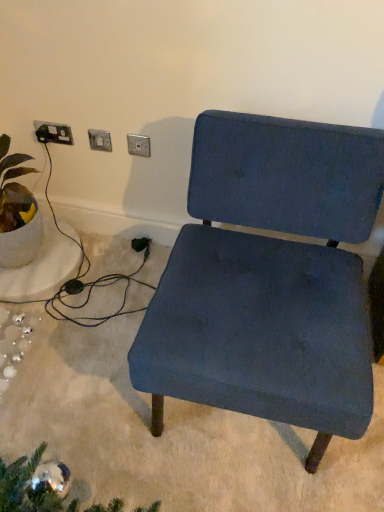
Question: Which direction should I rotate to look at matte silver switch at upper center, arranged as the second electric outlet when viewed from the right?

Choices:
 (A) right
 (B) left

Answer: (B)

Question: From the image's perspective, does black plastic socket at upper left, the first electric outlet positioned from the left, appear lower than metallic silver outlet at upper center, the 1th electric outlet from the right?

Choices:
 (A) yes
 (B) no

Answer: (B)

Question: Is black plastic socket at upper left, placed as the 3th electric outlet when sorted from right to left, wider than metallic silver outlet at upper center, the 1th electric outlet from the right?

Choices:
 (A) yes
 (B) no

Answer: (B)

Question: Does black plastic socket at upper left, the first electric outlet positioned from the left, have a lesser width compared to metallic silver outlet at upper center, the 1th electric outlet from the right?

Choices:
 (A) yes
 (B) no

Answer: (A)

Question: From a real-world perspective, is black plastic socket at upper left, placed as the 3th electric outlet when sorted from right to left, below metallic silver outlet at upper center, which is the third electric outlet in left-to-right order?

Choices:
 (A) yes
 (B) no

Answer: (B)

Question: Does black plastic socket at upper left, the first electric outlet positioned from the left, come in front of metallic silver outlet at upper center, the 1th electric outlet from the right?

Choices:
 (A) yes
 (B) no

Answer: (B)

Question: Would you say metallic silver outlet at upper center, the 1th electric outlet from the right, is part of black plastic socket at upper left, placed as the 3th electric outlet when sorted from right to left,'s contents?

Choices:
 (A) no
 (B) yes

Answer: (A)

Question: Considering the relative positions of matte blue fabric chair at center and matte silver switch at upper center, which appears as the 2th electric outlet when viewed from the left, in the image provided, is matte blue fabric chair at center behind matte silver switch at upper center, which appears as the 2th electric outlet when viewed from the left,?

Choices:
 (A) yes
 (B) no

Answer: (B)

Question: Is matte silver switch at upper center, which appears as the 2th electric outlet when viewed from the left, inside matte blue fabric chair at center?

Choices:
 (A) no
 (B) yes

Answer: (A)

Question: Would you say matte blue fabric chair at center is a long distance from matte silver switch at upper center, arranged as the second electric outlet when viewed from the right?

Choices:
 (A) yes
 (B) no

Answer: (B)

Question: From a real-world perspective, is matte blue fabric chair at center positioned under matte silver switch at upper center, arranged as the second electric outlet when viewed from the right, based on gravity?

Choices:
 (A) no
 (B) yes

Answer: (B)

Question: Is matte blue fabric chair at center taller than matte silver switch at upper center, arranged as the second electric outlet when viewed from the right?

Choices:
 (A) no
 (B) yes

Answer: (B)

Question: Does matte blue fabric chair at center have a greater width compared to matte silver switch at upper center, which appears as the 2th electric outlet when viewed from the left?

Choices:
 (A) no
 (B) yes

Answer: (B)

Question: Is matte silver switch at upper center, arranged as the second electric outlet when viewed from the right, aimed at green leafy plant in white pot at left?

Choices:
 (A) yes
 (B) no

Answer: (B)